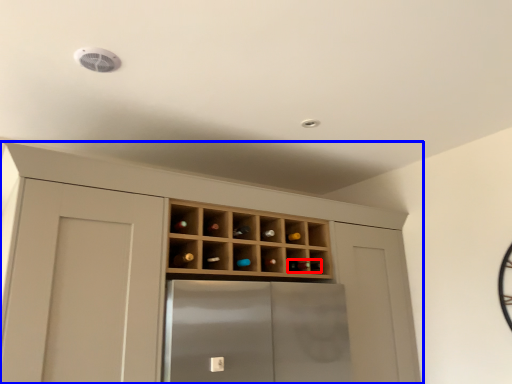
Question: Among these objects, which one is farthest to the camera, wine bottle (highlighted by a red box) or cupboard (highlighted by a blue box)?

Choices:
 (A) wine bottle
 (B) cupboard

Answer: (A)